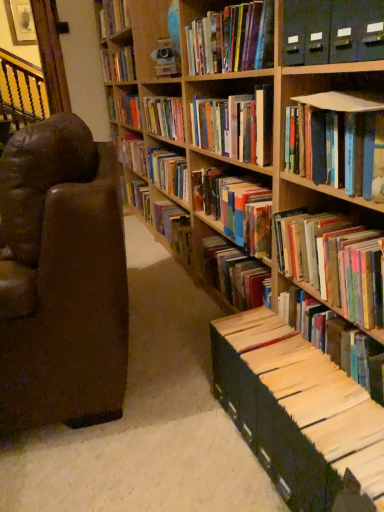
Question: Considering the positions of matte black file folders at upper right, which ranks as the 8th book in bottom-to-top order, and hardcover book at upper center, which is the 6th book in top-to-bottom order, in the image, is matte black file folders at upper right, which ranks as the 8th book in bottom-to-top order, taller or shorter than hardcover book at upper center, which is the 6th book in top-to-bottom order,?

Choices:
 (A) tall
 (B) short

Answer: (B)

Question: Considering the positions of matte black file folders at upper right, acting as the 4th book starting from the top, and hardcover book at upper center, which ranks as the 6th book in bottom-to-top order, in the image, is matte black file folders at upper right, acting as the 4th book starting from the top, bigger or smaller than hardcover book at upper center, which ranks as the 6th book in bottom-to-top order,?

Choices:
 (A) big
 (B) small

Answer: (B)

Question: Estimate the real-world distances between objects in this image. Which object is closer to the brown leather chair at left?

Choices:
 (A) hardcover book at center, the 7th book ordered from the bottom
 (B) hardcover book at upper center, the tenth book from the bottom
 (C) white paper at lower right, which is counted as the first book, starting from the bottom
 (D) matte black file folders at upper right, which ranks as the 8th book in bottom-to-top order
 (E) hardcover book at upper center, which ranks as the 6th book in bottom-to-top order

Answer: (E)

Question: Estimate the real-world distances between objects in this image. Which object is farther from the hardcover book at upper center, the 1th book positioned from the top?

Choices:
 (A) matte black file folders at upper right, which ranks as the 8th book in bottom-to-top order
 (B) hardcover book at upper center, the third book when ordered from top to bottom
 (C) hardcover book at upper center, the tenth book from the bottom
 (D) hardcover book at upper center, which is the 6th book in top-to-bottom order
 (E) hardcover book at center, which is counted as the ninth book, starting from the top

Answer: (D)